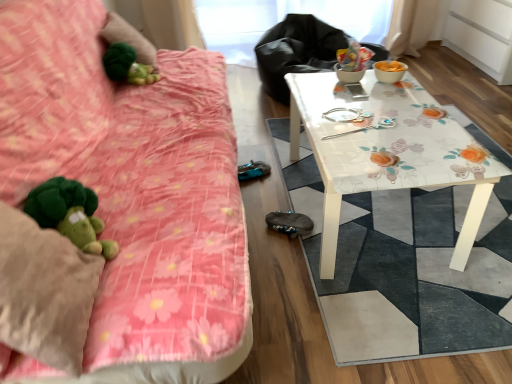
Where is `free space in front of metallic silver spoon at center`? The width and height of the screenshot is (512, 384). free space in front of metallic silver spoon at center is located at coordinates (373, 153).